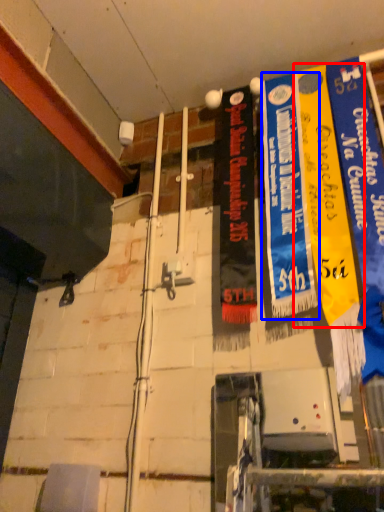
Question: Which object appears farthest to the camera in this image, poster (highlighted by a red box) or poster (highlighted by a blue box)?

Choices:
 (A) poster
 (B) poster

Answer: (B)